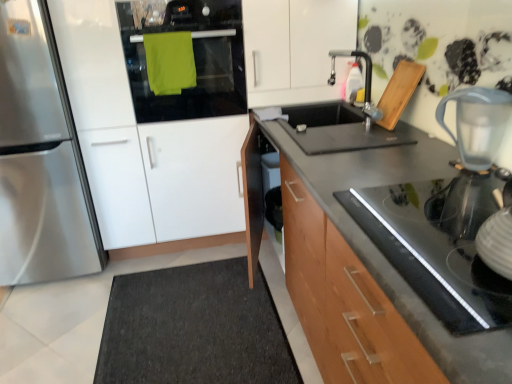
You are a GUI agent. You are given a task and a screenshot of the screen. Output one action in this format:
    pyautogui.click(x=<x>, y=<y>)
    Task: Click on the free spot above dark gray carpet at lower left (from a real-world perspective)
    This screenshot has width=512, height=384.
    Given the screenshot: What is the action you would take?
    pyautogui.click(x=137, y=308)